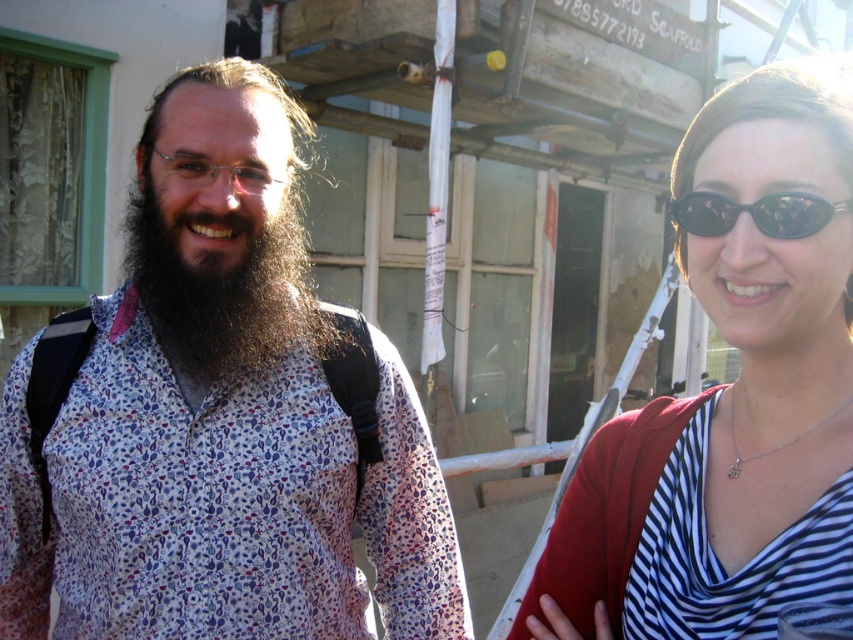
Can you confirm if floral-patterned shirt at left is positioned below striped fabric shirt at right?

No, floral-patterned shirt at left is not below striped fabric shirt at right.

Is floral-patterned shirt at left in front of striped fabric shirt at right?

No, it is behind striped fabric shirt at right.

Between point (181, 385) and point (695, 232), which one is positioned in front?

Point (695, 232) is in front.

Where is `floral-patterned shirt at left`? floral-patterned shirt at left is located at coordinates (219, 419).

Does floral-patterned shirt at left appear over black plastic sunglasses at upper right?

No, floral-patterned shirt at left is not above black plastic sunglasses at upper right.

Between point (265, 364) and point (677, 204), which one is positioned behind?

The point (265, 364) is behind.

Find the location of `floral-patterned shirt at left`. floral-patterned shirt at left is located at coordinates (219, 419).

Does floral-patterned shirt at left appear on the left side of brown fuzzy beard at left?

No, floral-patterned shirt at left is not to the left of brown fuzzy beard at left.

Which is below, floral-patterned shirt at left or brown fuzzy beard at left?

floral-patterned shirt at left is lower down.

Does point (222, 83) lie in front of point (210, 317)?

No.

The image size is (853, 640). Find the location of `floral-patterned shirt at left`. floral-patterned shirt at left is located at coordinates (219, 419).